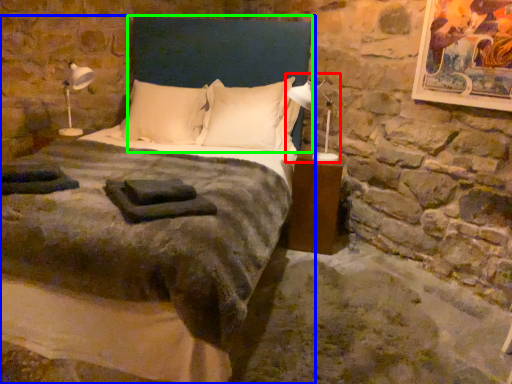
Question: Which object is the farthest from bedside lamp (highlighted by a red box)? Choose among these: bed (highlighted by a blue box) or headboard (highlighted by a green box).

Choices:
 (A) bed
 (B) headboard

Answer: (A)